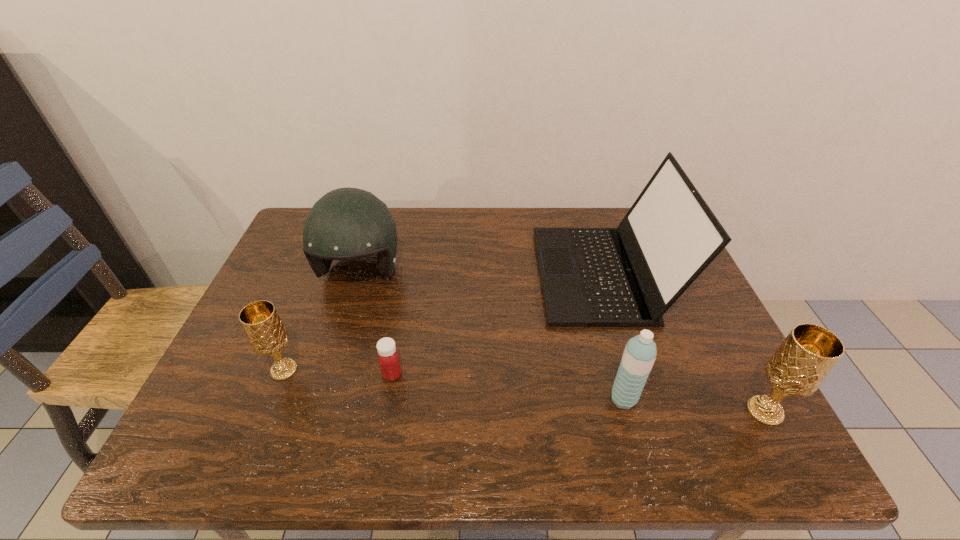
You are a GUI agent. You are given a task and a screenshot of the screen. Output one action in this format:
    pyautogui.click(x=<x>, y=<y>)
    Task: Click on the shorter chalice
    The width and height of the screenshot is (960, 540).
    Given the screenshot: What is the action you would take?
    pyautogui.click(x=266, y=333)

I want to click on the left chalice, so click(266, 333).

Where is `the rightmost object`? The height and width of the screenshot is (540, 960). the rightmost object is located at coordinates pos(802,362).

Find the location of a particular element. The image size is (960, 540). the taller chalice is located at coordinates (802, 362).

This screenshot has height=540, width=960. I want to click on laptop, so click(x=629, y=276).

I want to click on football helmet, so click(346, 223).

This screenshot has height=540, width=960. I want to click on the shortest object, so click(x=388, y=357).

In order to click on water bottle in this screenshot , I will do `click(639, 355)`.

Identify the location of vacant space positioned on the right of the shorter chalice. This screenshot has width=960, height=540. (398, 370).

Find the location of a particular element. vacant space situated on the back of the nearer chalice is located at coordinates (742, 370).